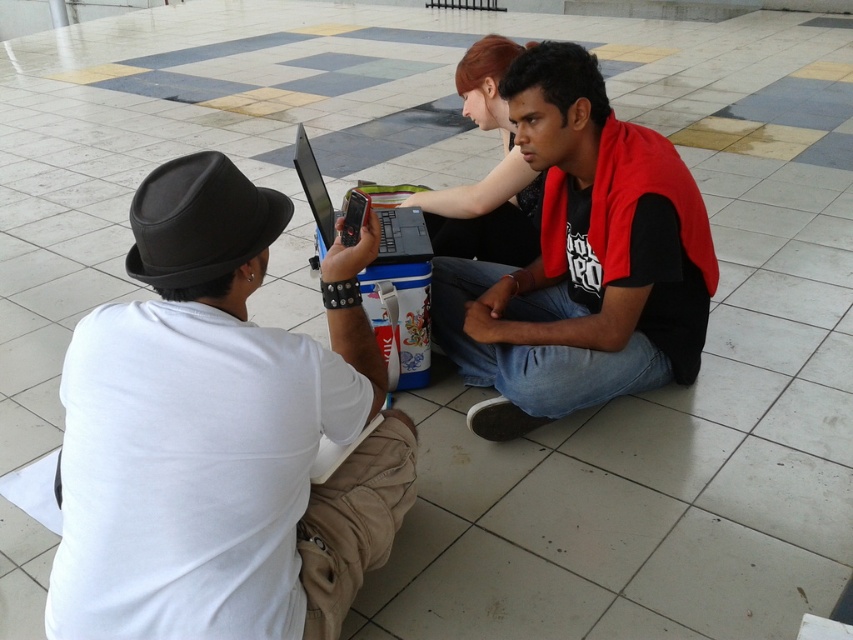
What is the color of the shirt at the location of point [219,433]?

The point [219,433] is on white matte shirt at left, so the color is white.